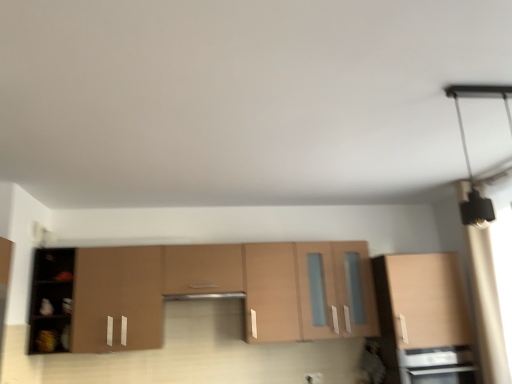
Image resolution: width=512 pixels, height=384 pixels. I want to click on free space above black matte light fixture at upper right (from a real-world perspective), so click(x=482, y=88).